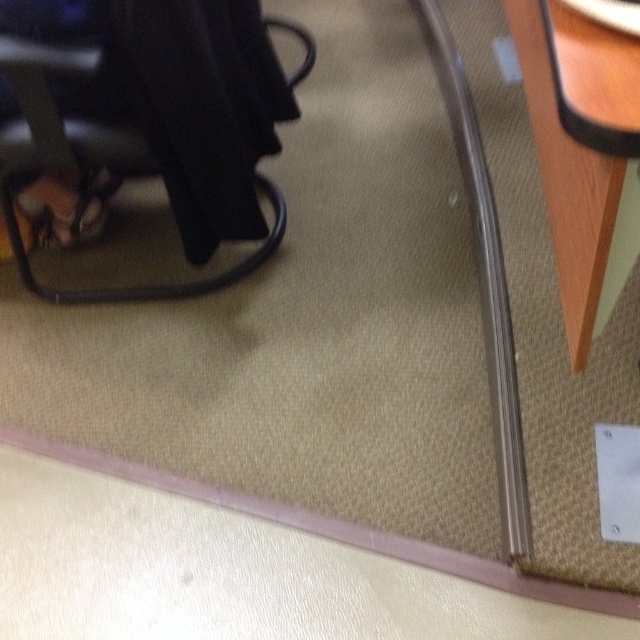
Question: Which point is closer to the camera?

Choices:
 (A) brown leather sandal at lower left
 (B) matte black chair at lower left

Answer: (B)

Question: Is wooden table at lower right positioned before brown leather sandal at lower left?

Choices:
 (A) no
 (B) yes

Answer: (B)

Question: In this image, where is matte black chair at lower left located relative to brown leather sandal at lower left?

Choices:
 (A) left
 (B) right

Answer: (B)

Question: Does matte black chair at lower left have a smaller size compared to brown leather sandal at lower left?

Choices:
 (A) no
 (B) yes

Answer: (A)

Question: Which point appears closest to the camera in this image?

Choices:
 (A) (124, 300)
 (B) (104, 182)

Answer: (A)

Question: Considering the real-world distances, which object is farthest from the matte black chair at lower left?

Choices:
 (A) wooden table at lower right
 (B) brown leather sandal at lower left

Answer: (A)